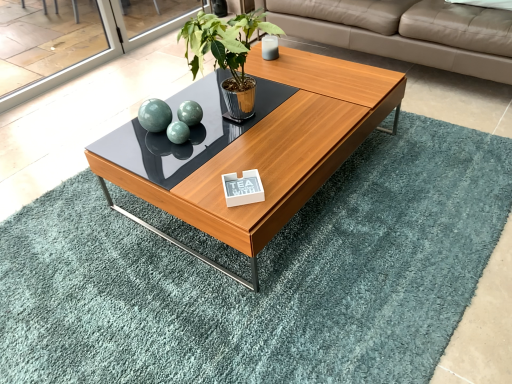
At what (x,y) coordinates should I click in order to perform the action: click on vacant area located to the right-hand side of green leafy plant at center. Please return your answer as a coordinate pair (x, y). Looking at the image, I should click on click(x=311, y=114).